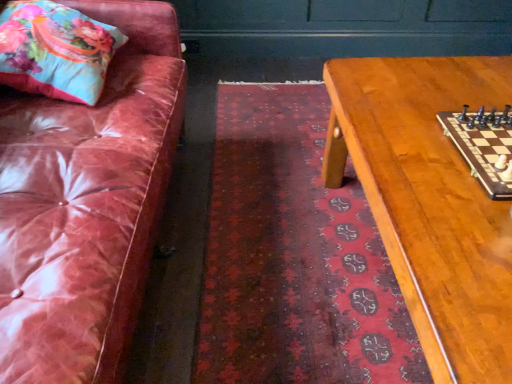
Find the location of a particular element. Image resolution: width=512 pixels, height=384 pixels. free space that is to the left of wooden chessboard at right is located at coordinates (411, 162).